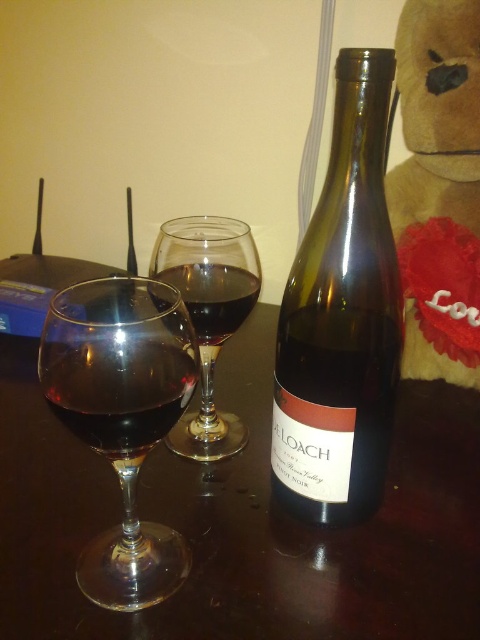
You are a guest at a dinner party and want to pour more wine into the transparent glass wine glass at left. The wine bottle is on the dark brown wood table at center. To avoid spilling, you need to know which object is closer to you. Which one is closer?

The transparent glass wine glass at left is closer to you than the dark brown wood table at center because the table is positioned to the right of the glass.

You are a bartender preparing to place a coaster between the transparent glass at center and the dark glass at center. The coaster has a diameter of 1.5 inches. Will the coaster fit between them without overlapping either glass?

The transparent glass at center and dark glass at center are 1.23 inches apart. Since the coaster is 1.5 inches in diameter, which is larger than the 1.23 inches gap between them, the coaster cannot fit between the two glasses without overlapping.